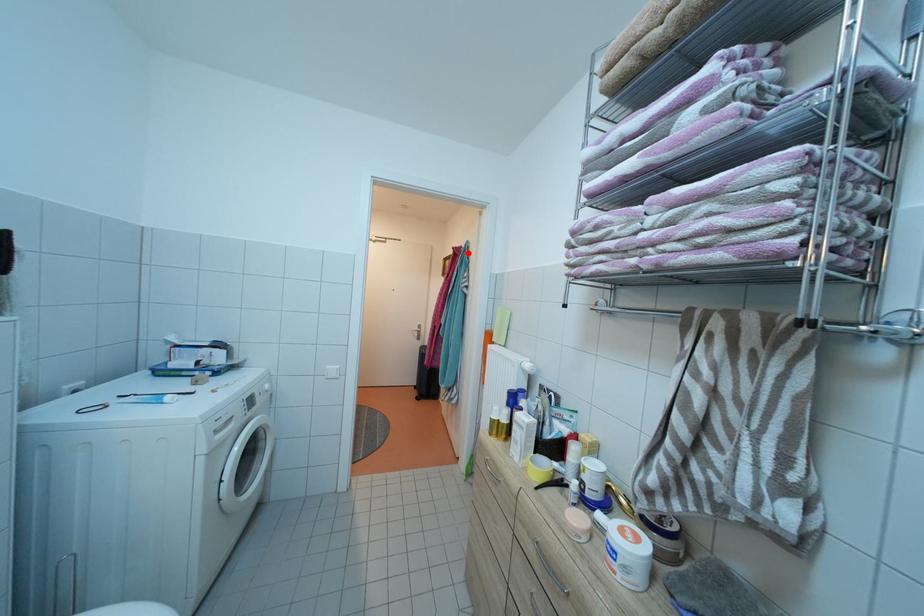
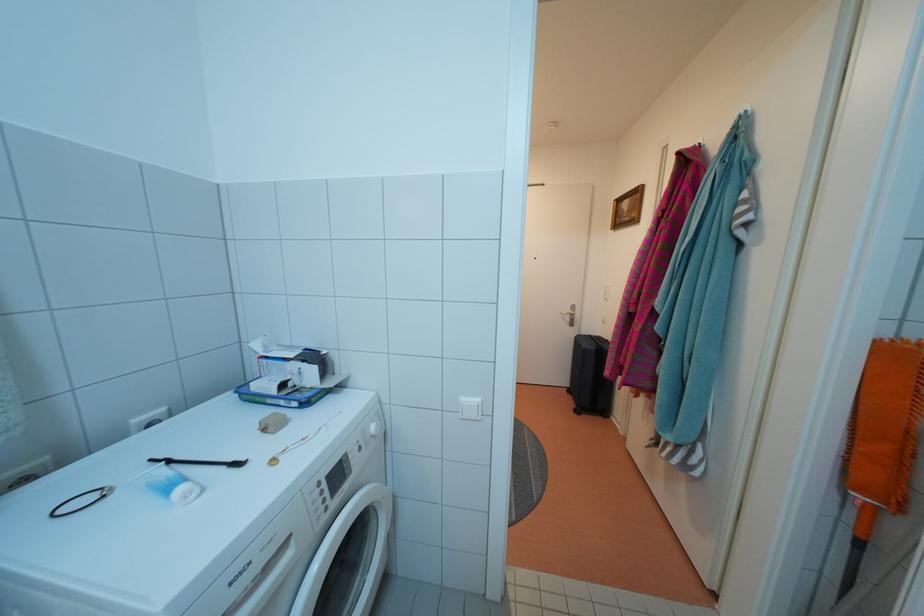
Locate, in the second image, the point that corresponds to the highlighted location in the first image.

(704, 153)